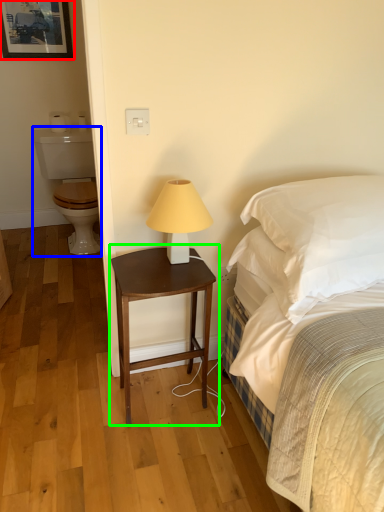
Question: Which object is positioned closest to picture frame (highlighted by a red box)? Select from sit (highlighted by a blue box) and nightstand (highlighted by a green box).

Choices:
 (A) sit
 (B) nightstand

Answer: (A)